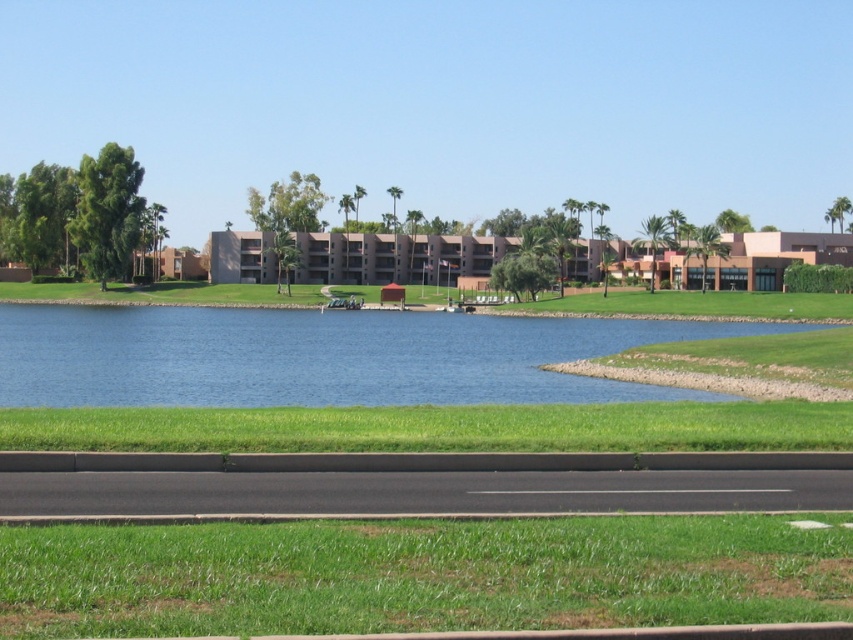
Does green grass at lower center appear under blue water at center?

No, green grass at lower center is not below blue water at center.

Does green grass at lower center have a lesser width compared to blue water at center?

Correct, green grass at lower center's width is less than blue water at center's.

The height and width of the screenshot is (640, 853). What are the coordinates of `green grass at lower center` in the screenshot? It's located at (421, 576).